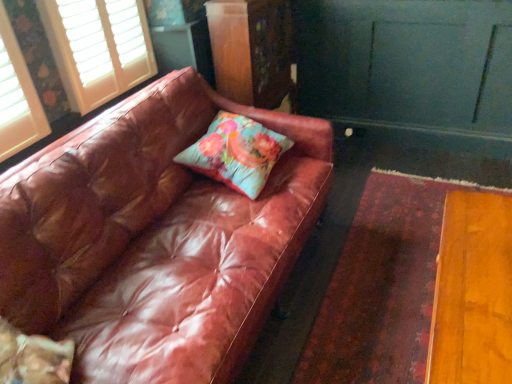
At what (x,y) coordinates should I click in order to perform the action: click on wooden dresser at center. Please return your answer as a coordinate pair (x, y). Looking at the image, I should click on (251, 50).

Image resolution: width=512 pixels, height=384 pixels. Find the location of `floral fabric cushion at center`. floral fabric cushion at center is located at coordinates [236, 153].

Identify the location of leather couch at left. (154, 238).

The height and width of the screenshot is (384, 512). I want to click on wooden dresser at center, so click(251, 50).

Is point (138, 6) positioned behind point (244, 83)?

That is False.

Choose the correct answer: Is white wood blinds at upper left inside wooden dresser at center or outside it?

white wood blinds at upper left cannot be found inside wooden dresser at center.

Which object is more forward, white wood blinds at upper left or wooden dresser at center?

Positioned in front is white wood blinds at upper left.

What's the angular difference between wooden dresser at center and floral fabric cushion at center's facing directions?

They differ by 0.407 degrees in their facing directions.

Is wooden dresser at center taller or shorter than floral fabric cushion at center?

wooden dresser at center is taller than floral fabric cushion at center.

From the image's perspective, is wooden dresser at center under floral fabric cushion at center?

No.

The height and width of the screenshot is (384, 512). I want to click on dresser below the white wood blinds at upper left (from a real-world perspective), so click(251, 50).

Who is taller, wooden dresser at center or white wood blinds at upper left?

With more height is wooden dresser at center.

Can you confirm if wooden dresser at center is smaller than white wood blinds at upper left?

No, wooden dresser at center is not smaller than white wood blinds at upper left.

Does point (242, 96) appear closer or farther from the camera than point (87, 25)?

Point (242, 96) is farther from the camera than point (87, 25).

Between white wood blinds at upper left and leather couch at left, which one has more height?

leather couch at left.

Image resolution: width=512 pixels, height=384 pixels. What are the coordinates of `window lying behind the leather couch at left` in the screenshot? It's located at (98, 47).

How different are the orientations of white wood blinds at upper left and leather couch at left in degrees?

white wood blinds at upper left and leather couch at left are facing 1.14 degrees away from each other.

Which is correct: white wood blinds at upper left is inside leather couch at left, or outside of it?

white wood blinds at upper left is not enclosed by leather couch at left.

Consider the image. Is leather couch at left positioned far away from floral fabric cushion at center?

That's not correct — leather couch at left is a little close to floral fabric cushion at center.

From the image's perspective, is leather couch at left above or below floral fabric cushion at center?

Clearly, from the image's perspective, leather couch at left is below floral fabric cushion at center.

Which point is more distant from viewer, (2,288) or (220,154)?

The point (220,154) is farther from the camera.

Is floral fabric cushion at center in contact with wooden dresser at center?

They are not placed beside each other.

Can you tell me how much floral fabric cushion at center and wooden dresser at center differ in facing direction?

The facing directions of floral fabric cushion at center and wooden dresser at center are 0.407 degrees apart.

Which is behind, point (220, 141) or point (213, 0)?

The point (213, 0) is farther.

From the image's perspective, is floral fabric cushion at center over wooden dresser at center?

Actually, floral fabric cushion at center appears below wooden dresser at center in the image.

Is wooden dresser at center thinner than leather couch at left?

Correct, the width of wooden dresser at center is less than that of leather couch at left.

Considering the sizes of objects wooden dresser at center and leather couch at left in the image provided, who is shorter, wooden dresser at center or leather couch at left?

leather couch at left is shorter.

Is wooden dresser at center looking in the opposite direction of leather couch at left?

No, wooden dresser at center is not facing the opposite direction of leather couch at left.

Image resolution: width=512 pixels, height=384 pixels. I want to click on dresser located behind the white wood blinds at upper left, so click(251, 50).

The height and width of the screenshot is (384, 512). Find the location of `pillow on the left of wooden dresser at center`. pillow on the left of wooden dresser at center is located at coordinates (236, 153).

When comparing their distances from wooden dresser at center, does leather couch at left or floral fabric cushion at center seem further?

leather couch at left lies further to wooden dresser at center than the other object.

Estimate the real-world distances between objects in this image. Which object is closer to white wood blinds at upper left, floral fabric cushion at center or leather couch at left?

leather couch at left is positioned closer to the anchor white wood blinds at upper left.

Estimate the real-world distances between objects in this image. Which object is further from floral fabric cushion at center, leather couch at left or wooden dresser at center?

wooden dresser at center is positioned further to the anchor floral fabric cushion at center.

Estimate the real-world distances between objects in this image. Which object is further from white wood blinds at upper left, leather couch at left or floral fabric cushion at center?

floral fabric cushion at center is further to white wood blinds at upper left.

Based on their spatial positions, is wooden dresser at center or floral fabric cushion at center closer to leather couch at left?

Based on the image, floral fabric cushion at center appears to be nearer to leather couch at left.

Considering their positions, is white wood blinds at upper left positioned closer to floral fabric cushion at center than wooden dresser at center?

Based on the image, wooden dresser at center appears to be nearer to floral fabric cushion at center.

Which object lies nearer to the anchor point floral fabric cushion at center, wooden dresser at center or white wood blinds at upper left?

wooden dresser at center lies closer to floral fabric cushion at center than the other object.

Looking at this image, considering their positions, is white wood blinds at upper left positioned further to leather couch at left than wooden dresser at center?

wooden dresser at center is further to leather couch at left.

Find the location of `pillow between leather couch at left and white wood blinds at upper left in the front-back direction`. pillow between leather couch at left and white wood blinds at upper left in the front-back direction is located at coordinates (236, 153).

Locate an element on the screen. window between leather couch at left and wooden dresser at center from front to back is located at coordinates (98, 47).

Locate an element on the screen. pillow situated between white wood blinds at upper left and wooden dresser at center from left to right is located at coordinates (236, 153).

This screenshot has height=384, width=512. I want to click on pillow between leather couch at left and wooden dresser at center along the z-axis, so click(x=236, y=153).